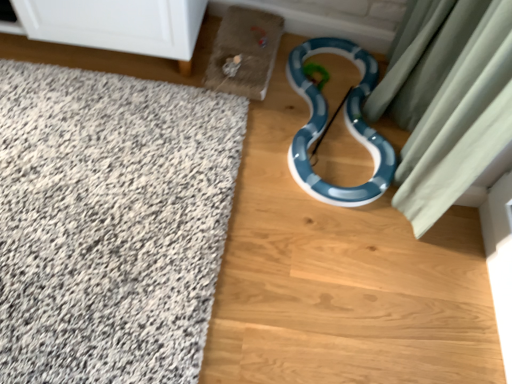
Measure the distance between white glossy cabinet at upper left and camera.

white glossy cabinet at upper left and camera are 4.54 feet apart from each other.

Locate an element on the screen. blue glossy snake at center is located at coordinates (345, 122).

What do you see at coordinates (341, 278) in the screenshot? I see `blue glossy dirt track at center-right` at bounding box center [341, 278].

You are a GUI agent. You are given a task and a screenshot of the screen. Output one action in this format:
    pyautogui.click(x=<x>, y=<y>)
    Task: Click on the white shaggy bath mat at left
    
    Given the screenshot: What is the action you would take?
    pyautogui.click(x=110, y=223)

Which object is positioned more to the right, blue glossy dirt track at center-right or white shaggy bath mat at left?

From the viewer's perspective, blue glossy dirt track at center-right appears more on the right side.

From the image's perspective, which one is positioned lower, blue glossy dirt track at center-right or white shaggy bath mat at left?

white shaggy bath mat at left is shown below in the image.

Does blue glossy dirt track at center-right have a larger size compared to white shaggy bath mat at left?

Indeed, blue glossy dirt track at center-right has a larger size compared to white shaggy bath mat at left.

Can you tell me how much blue glossy dirt track at center-right and white shaggy bath mat at left differ in facing direction?

The angular difference between blue glossy dirt track at center-right and white shaggy bath mat at left is 1.45 degrees.

From the image's perspective, is blue glossy dirt track at center-right positioned above or below blue glossy snake at center?

Clearly, from the image's perspective, blue glossy dirt track at center-right is below blue glossy snake at center.

Is blue glossy dirt track at center-right positioned with its back to blue glossy snake at center?

blue glossy dirt track at center-right is not turned away from blue glossy snake at center.

Considering the relative sizes of blue glossy dirt track at center-right and blue glossy snake at center in the image provided, is blue glossy dirt track at center-right thinner than blue glossy snake at center?

In fact, blue glossy dirt track at center-right might be wider than blue glossy snake at center.

Considering the points (394, 325) and (311, 112), which point is in front, point (394, 325) or point (311, 112)?

The point (394, 325) is closer.

Is white glossy cabinet at upper left bigger than blue glossy dirt track at center-right?

Incorrect, white glossy cabinet at upper left is not larger than blue glossy dirt track at center-right.

Is white glossy cabinet at upper left facing towards blue glossy dirt track at center-right?

Yes, white glossy cabinet at upper left faces towards blue glossy dirt track at center-right.

Is blue glossy dirt track at center-right located within white glossy cabinet at upper left?

No, blue glossy dirt track at center-right is not inside white glossy cabinet at upper left.

Which point is more forward, (112, 19) or (348, 345)?

Positioned in front is point (348, 345).

Does point (58, 25) appear closer or farther from the camera than point (311, 167)?

Point (58, 25).

Does white glossy cabinet at upper left turn towards blue glossy snake at center?

No, white glossy cabinet at upper left does not turn towards blue glossy snake at center.

From a real-world perspective, is white glossy cabinet at upper left positioned above or below blue glossy snake at center?

white glossy cabinet at upper left is situated higher than blue glossy snake at center in the real world.

You are a GUI agent. You are given a task and a screenshot of the screen. Output one action in this format:
    pyautogui.click(x=<x>, y=<y>)
    Task: Click on the furniture in front of the blue glossy snake at center
    The height and width of the screenshot is (384, 512).
    Given the screenshot: What is the action you would take?
    coord(117,25)

Can you confirm if blue glossy snake at center is taller than white glossy cabinet at upper left?

Incorrect, the height of blue glossy snake at center is not larger of that of white glossy cabinet at upper left.

Based on the photo, could white glossy cabinet at upper left be considered to be inside blue glossy snake at center?

No, blue glossy snake at center does not contain white glossy cabinet at upper left.

Based on their sizes in the image, would you say blue glossy snake at center is bigger or smaller than white glossy cabinet at upper left?

blue glossy snake at center is smaller than white glossy cabinet at upper left.

Considering the sizes of blue glossy snake at center and white glossy cabinet at upper left in the image, is blue glossy snake at center wider or thinner than white glossy cabinet at upper left?

Clearly, blue glossy snake at center has more width compared to white glossy cabinet at upper left.

From the image's perspective, is blue glossy snake at center beneath blue glossy dirt track at center-right?

Incorrect, from the image's perspective, blue glossy snake at center is higher than blue glossy dirt track at center-right.

Does blue glossy snake at center have a lesser height compared to blue glossy dirt track at center-right?

Yes, blue glossy snake at center is shorter than blue glossy dirt track at center-right.

Is blue glossy snake at center looking in the opposite direction of blue glossy dirt track at center-right?

blue glossy snake at center is not turned away from blue glossy dirt track at center-right.

Between blue glossy snake at center and blue glossy dirt track at center-right, which one has smaller width?

blue glossy snake at center.

What's the angular difference between white shaggy bath mat at left and white glossy cabinet at upper left's facing directions?

There is a 0.196-degree angle between the facing directions of white shaggy bath mat at left and white glossy cabinet at upper left.

Is white shaggy bath mat at left to the left of white glossy cabinet at upper left from the viewer's perspective?

No, white shaggy bath mat at left is not to the left of white glossy cabinet at upper left.

Based on the photo, is there a large distance between white shaggy bath mat at left and white glossy cabinet at upper left?

No, white shaggy bath mat at left is not far away from white glossy cabinet at upper left.

From the picture: Is white shaggy bath mat at left taller or shorter than white glossy cabinet at upper left?

Considering their sizes, white shaggy bath mat at left has less height than white glossy cabinet at upper left.

This screenshot has width=512, height=384. Find the location of `bath mat in front of the blue glossy dirt track at center-right`. bath mat in front of the blue glossy dirt track at center-right is located at coordinates (110, 223).

This screenshot has height=384, width=512. I want to click on dirt track to the left of blue glossy snake at center, so click(341, 278).

Looking at the image, which one is located closer to blue glossy snake at center, white shaggy bath mat at left or blue glossy dirt track at center-right?

The object closer to blue glossy snake at center is blue glossy dirt track at center-right.

When comparing their distances from blue glossy dirt track at center-right, does white glossy cabinet at upper left or blue glossy snake at center seem further?

white glossy cabinet at upper left.

Based on the photo, looking at the image, which one is located further to blue glossy dirt track at center-right, blue glossy snake at center or white shaggy bath mat at left?

Based on the image, white shaggy bath mat at left appears to be further to blue glossy dirt track at center-right.

When comparing their distances from white glossy cabinet at upper left, does white shaggy bath mat at left or blue glossy dirt track at center-right seem further?

blue glossy dirt track at center-right.

Which object lies nearer to the anchor point blue glossy snake at center, white glossy cabinet at upper left or white shaggy bath mat at left?

white shaggy bath mat at left.

Which object lies nearer to the anchor point white glossy cabinet at upper left, blue glossy snake at center or blue glossy dirt track at center-right?

Among the two, blue glossy snake at center is located nearer to white glossy cabinet at upper left.

When comparing their distances from white glossy cabinet at upper left, does blue glossy dirt track at center-right or blue glossy snake at center seem closer?

Based on the image, blue glossy snake at center appears to be nearer to white glossy cabinet at upper left.

When comparing their distances from white glossy cabinet at upper left, does blue glossy dirt track at center-right or white shaggy bath mat at left seem closer?

white shaggy bath mat at left lies closer to white glossy cabinet at upper left than the other object.

Locate an element on the screen. The image size is (512, 384). dirt track between white glossy cabinet at upper left and white shaggy bath mat at left vertically is located at coordinates (341, 278).

The height and width of the screenshot is (384, 512). I want to click on dirt track between white shaggy bath mat at left and blue glossy snake at center from left to right, so click(x=341, y=278).

Where is `bath mat between white glossy cabinet at upper left and blue glossy snake at center in the horizontal direction`? bath mat between white glossy cabinet at upper left and blue glossy snake at center in the horizontal direction is located at coordinates (110, 223).

Find the location of `dirt track between white glossy cabinet at upper left and blue glossy snake at center`. dirt track between white glossy cabinet at upper left and blue glossy snake at center is located at coordinates (341, 278).